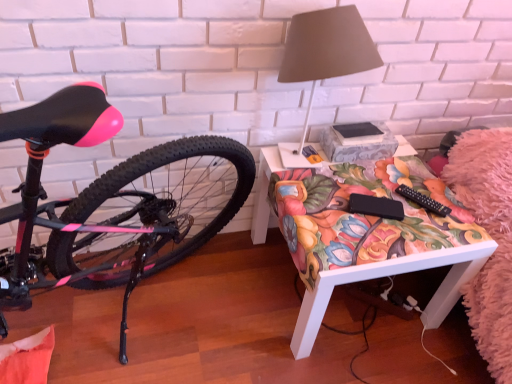
You are a GUI agent. You are given a task and a screenshot of the screen. Output one action in this format:
    pyautogui.click(x=<x>, y=<y>)
    Task: Click on the matte gray lampshade at upper right
    Image resolution: width=512 pixels, height=384 pixels.
    Given the screenshot: What is the action you would take?
    pyautogui.click(x=326, y=50)

Is floral fabric desk at center at the left side of black plastic remote control at lower right?

Indeed, floral fabric desk at center is positioned on the left side of black plastic remote control at lower right.

Is floral fabric desk at center inside the boundaries of black plastic remote control at lower right, or outside?

floral fabric desk at center is not inside black plastic remote control at lower right, it's outside.

From a real-world perspective, is floral fabric desk at center physically above black plastic remote control at lower right?

No, from a real-world perspective, floral fabric desk at center is not over black plastic remote control at lower right

Which object is more forward, floral fabric desk at center or black plastic remote control at lower right?

Positioned in front is floral fabric desk at center.

Considering the sizes of objects floral fabric desk at center and matte gray lampshade at upper right in the image provided, who is bigger, floral fabric desk at center or matte gray lampshade at upper right?

floral fabric desk at center is bigger.

Can you confirm if floral fabric desk at center is wider than matte gray lampshade at upper right?

Correct, the width of floral fabric desk at center exceeds that of matte gray lampshade at upper right.

Does point (298, 357) appear closer or farther from the camera than point (344, 52)?

Point (298, 357) is farther from the camera than point (344, 52).

In the image, there is a matte gray lampshade at upper right. At what (x,y) coordinates should I click in order to perform the action: click on desk below it (from a real-world perspective). Please return your answer as a coordinate pair (x, y). Looking at the image, I should click on (391, 275).

Would you say matte gray lampshade at upper right is to the left or to the right of black plastic remote control at lower right in the picture?

Clearly, matte gray lampshade at upper right is on the left of black plastic remote control at lower right in the image.

Which of these two, matte gray lampshade at upper right or black plastic remote control at lower right, stands shorter?

With less height is black plastic remote control at lower right.

Looking at their sizes, would you say matte gray lampshade at upper right is wider or thinner than black plastic remote control at lower right?

In the image, matte gray lampshade at upper right appears to be wider than black plastic remote control at lower right.

What's the angular difference between matte gray lampshade at upper right and black plastic remote control at lower right's facing directions?

The angle between the facing direction of matte gray lampshade at upper right and the facing direction of black plastic remote control at lower right is 31.5 degrees.

Is black plastic remote control at lower right to the right of matte gray lampshade at upper right from the viewer's perspective?

Indeed, black plastic remote control at lower right is positioned on the right side of matte gray lampshade at upper right.

From the image's perspective, who appears lower, black plastic remote control at lower right or matte gray lampshade at upper right?

black plastic remote control at lower right appears lower in the image.

Is black plastic remote control at lower right in contact with matte gray lampshade at upper right?

No, black plastic remote control at lower right is not with matte gray lampshade at upper right.

Find the location of a particular element. Image resolution: width=512 pixels, height=384 pixels. desk that is under the matte gray lampshade at upper right (from a real-world perspective) is located at coordinates (391, 275).

Is matte gray lampshade at upper right not near floral fabric desk at center?

That's not correct — matte gray lampshade at upper right is a little close to floral fabric desk at center.

From the image's perspective, which object appears higher, matte gray lampshade at upper right or floral fabric desk at center?

matte gray lampshade at upper right, from the image's perspective.

Which object is closer to the camera, matte gray lampshade at upper right or floral fabric desk at center?

matte gray lampshade at upper right.

Can you confirm if black plastic remote control at lower right is wider than floral fabric desk at center?

Incorrect, the width of black plastic remote control at lower right does not surpass that of floral fabric desk at center.

What's the angular difference between black plastic remote control at lower right and floral fabric desk at center's facing directions?

black plastic remote control at lower right and floral fabric desk at center are facing 31 degrees away from each other.

From the picture: Considering the positions of objects black plastic remote control at lower right and floral fabric desk at center in the image provided, who is in front, black plastic remote control at lower right or floral fabric desk at center?

Positioned in front is floral fabric desk at center.

Where is `remote control behind the floral fabric desk at center`? Image resolution: width=512 pixels, height=384 pixels. remote control behind the floral fabric desk at center is located at coordinates (423, 201).

In the image, there is a matte gray lampshade at upper right. Where is `desk below it (from a real-world perspective)`? The image size is (512, 384). desk below it (from a real-world perspective) is located at coordinates (391, 275).

Which object lies further to the anchor point black plastic remote control at lower right, matte gray lampshade at upper right or floral fabric desk at center?

Based on the image, matte gray lampshade at upper right appears to be further to black plastic remote control at lower right.

Based on the photo, which object lies nearer to the anchor point matte gray lampshade at upper right, floral fabric desk at center or black plastic remote control at lower right?

black plastic remote control at lower right is positioned closer to the anchor matte gray lampshade at upper right.

Based on their spatial positions, is black plastic remote control at lower right or matte gray lampshade at upper right closer to floral fabric desk at center?

black plastic remote control at lower right.

Based on the photo, from the image, which object appears to be farther from black plastic remote control at lower right, floral fabric desk at center or matte gray lampshade at upper right?

matte gray lampshade at upper right.

Based on their spatial positions, is black plastic remote control at lower right or floral fabric desk at center closer to matte gray lampshade at upper right?

The object closer to matte gray lampshade at upper right is black plastic remote control at lower right.

Which object lies further to the anchor point floral fabric desk at center, matte gray lampshade at upper right or black plastic remote control at lower right?

matte gray lampshade at upper right.

Where is `remote control between matte gray lampshade at upper right and floral fabric desk at center in the up-down direction`? This screenshot has height=384, width=512. remote control between matte gray lampshade at upper right and floral fabric desk at center in the up-down direction is located at coordinates (423, 201).